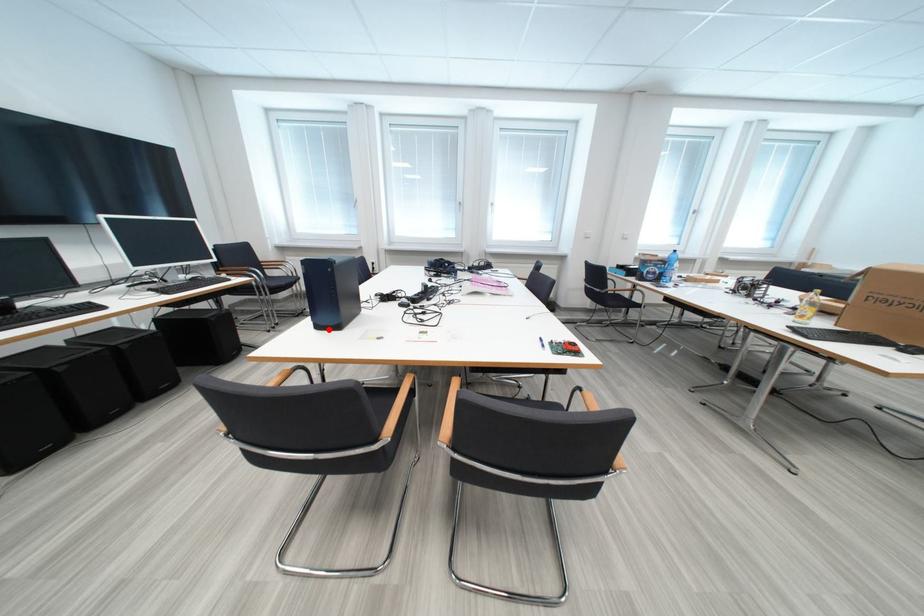
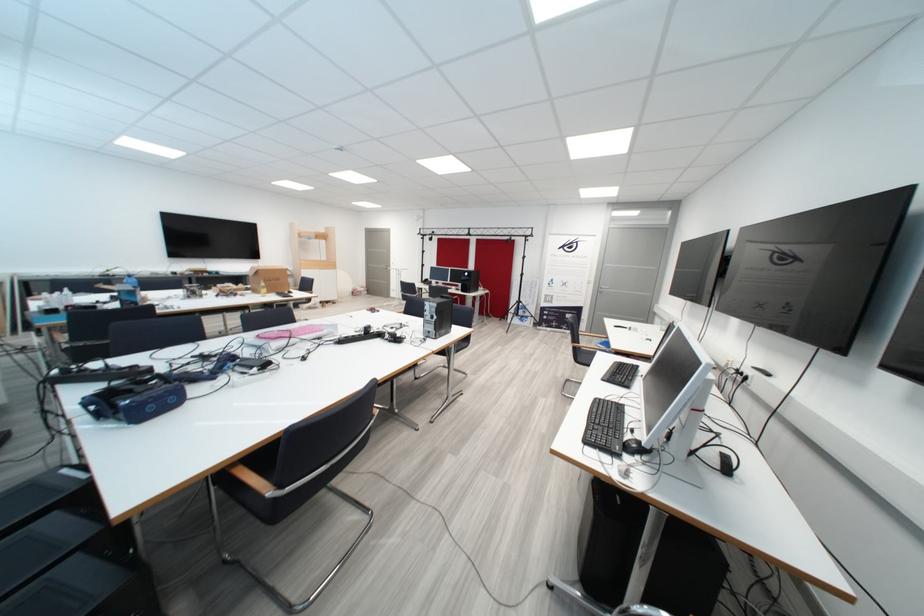
Question: I am providing you with two images of the same scene from different viewpoints. A red point is marked on the first image. At the location where the point appears in image 1, is it still visible in image 2?

Choices:
 (A) Yes
 (B) No

Answer: (B)